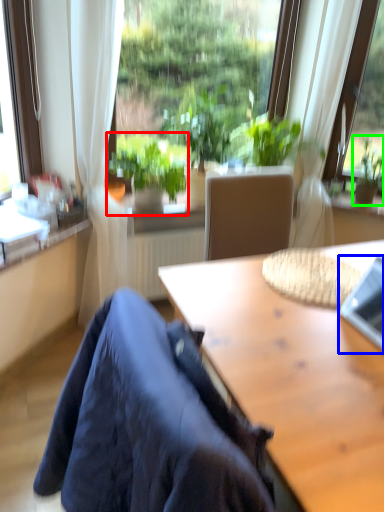
Question: Considering the real-world distances, which object is farthest from houseplant (highlighted by a red box)? laptop (highlighted by a blue box) or houseplant (highlighted by a green box)?

Choices:
 (A) laptop
 (B) houseplant

Answer: (B)